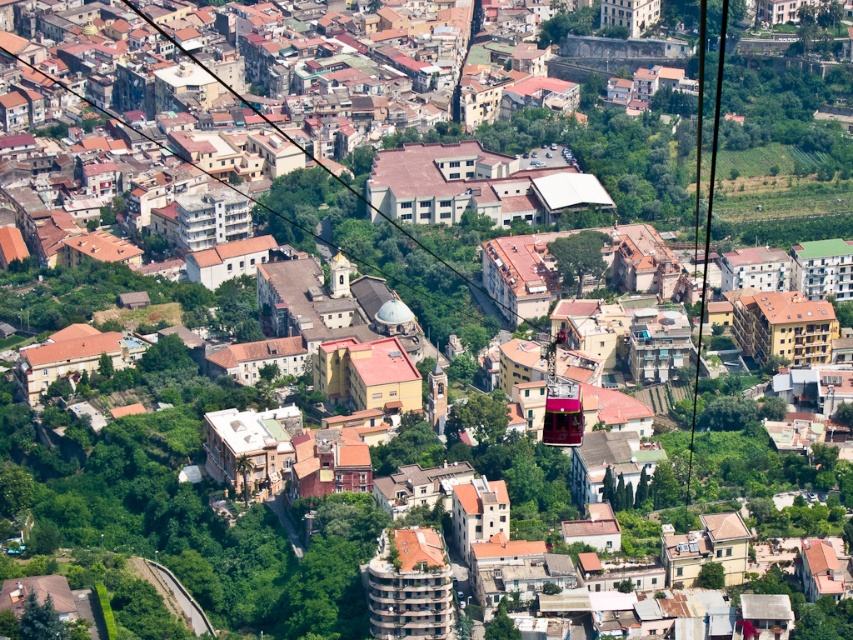
Who is taller, black cable at right or metallic cable car at center?

black cable at right

Is black cable at right above metallic cable car at center?

Correct, black cable at right is located above metallic cable car at center.

Based on the photo, who is more forward, (706, 237) or (567, 412)?

Point (567, 412)

Identify the location of black cable at right. (706, 236).